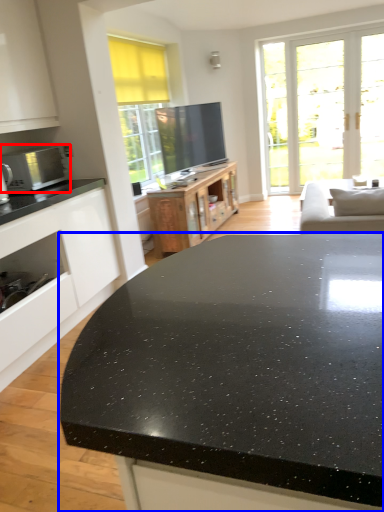
Question: Which of the following is the farthest to the observer, microwave oven (highlighted by a red box) or countertop (highlighted by a blue box)?

Choices:
 (A) microwave oven
 (B) countertop

Answer: (A)